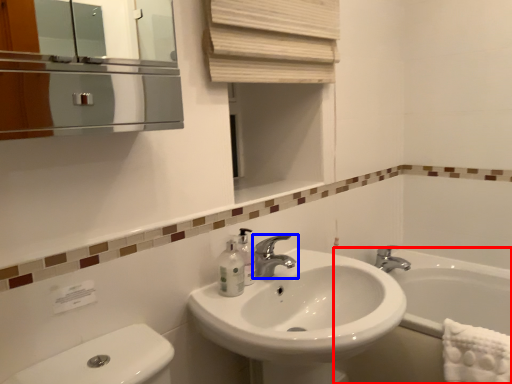
Question: Which object is further to the camera taking this photo, bath (highlighted by a red box) or tap (highlighted by a blue box)?

Choices:
 (A) bath
 (B) tap

Answer: (A)